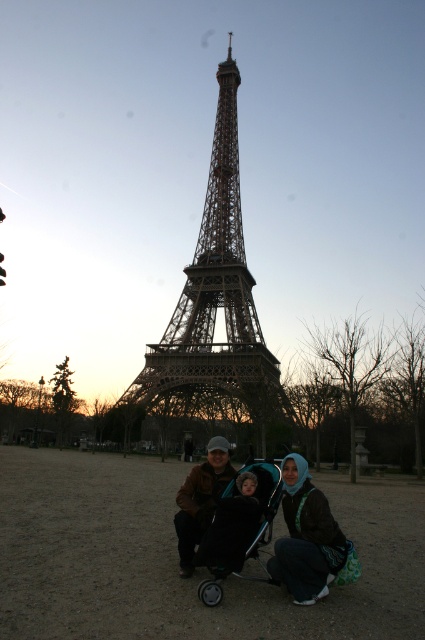
Looking at this image, you are a photographer standing at the base of the Eiffel Tower and want to capture a photo of the two people in front of the tower. The green fabric hijab at center and the brown leather jacket at center are both visible. Which object appears taller in the photo?

The green fabric hijab at center appears taller in the photo because it has a greater height compared to the brown leather jacket at center.

You are standing at the base of the Eiffel Tower and want to take a photo that includes both the metallic structure at center and the two adults kneeling in the foreground. Based on their positions, where should you position yourself to ensure both are in the frame?

The metallic structure at center is located at point [215,300], so you should position yourself in a spot that allows you to capture both the foreground adults and the central metallic structure by aligning your camera towards the coordinates mentioned.

Based on the photo, you are standing at the base of the Eiffel Tower and want to take a photo of the dark brown leather jacket at center. The camera you have is a standard DSLR with a 50mm lens. Considering the distance between the jacket and the camera is 376.11 feet, will you be able to capture the entire jacket in the photo without zooming in?

The dark brown leather jacket at center and camera are 376.11 feet apart from each other. A standard DSLR with a 50mm lens has a field of view that can capture objects at that distance without needing to zoom in. Therefore, you should be able to capture the entire jacket in the photo without zooming in.